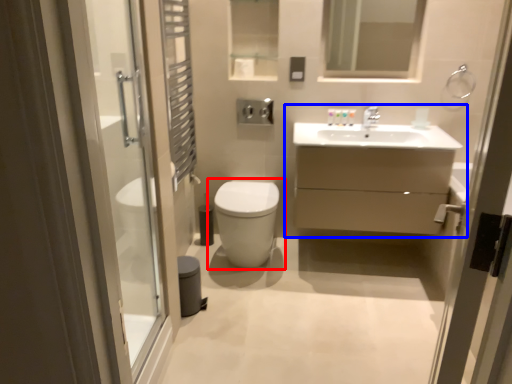
Question: Which point is closer to the camera, toilet (highlighted by a red box) or bathroom cabinet (highlighted by a blue box)?

Choices:
 (A) toilet
 (B) bathroom cabinet

Answer: (B)